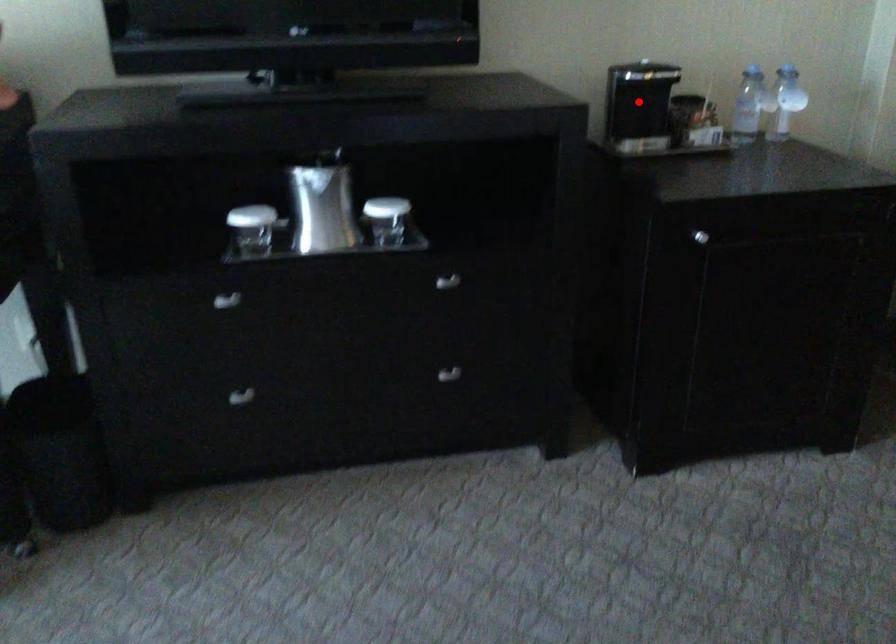
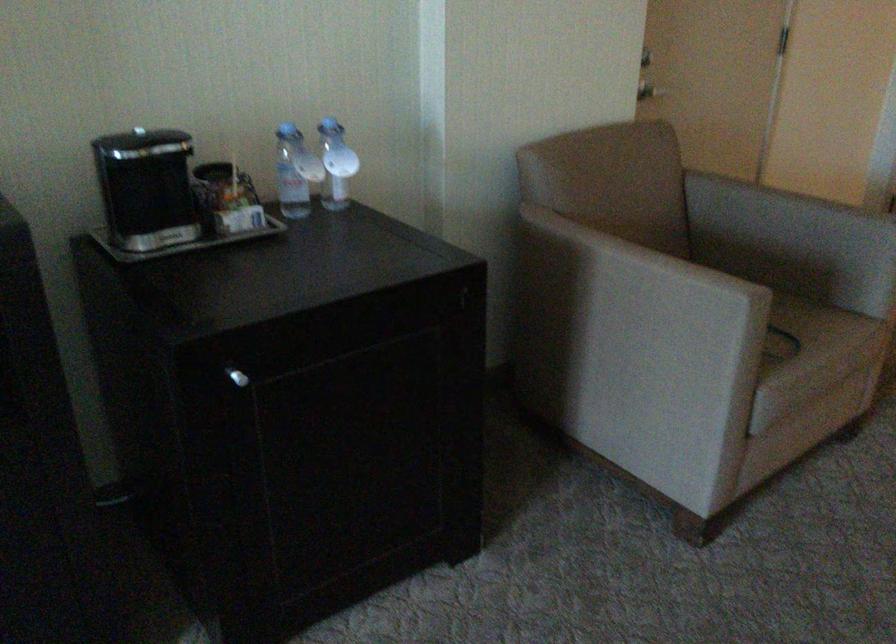
Question: A red point is marked in image1. In image2, is the corresponding 3D point closer to the camera or farther? Reply with the corresponding letter.

Choices:
 (A) The corresponding 3D point is closer.
 (B) The corresponding 3D point is farther.

Answer: (A)